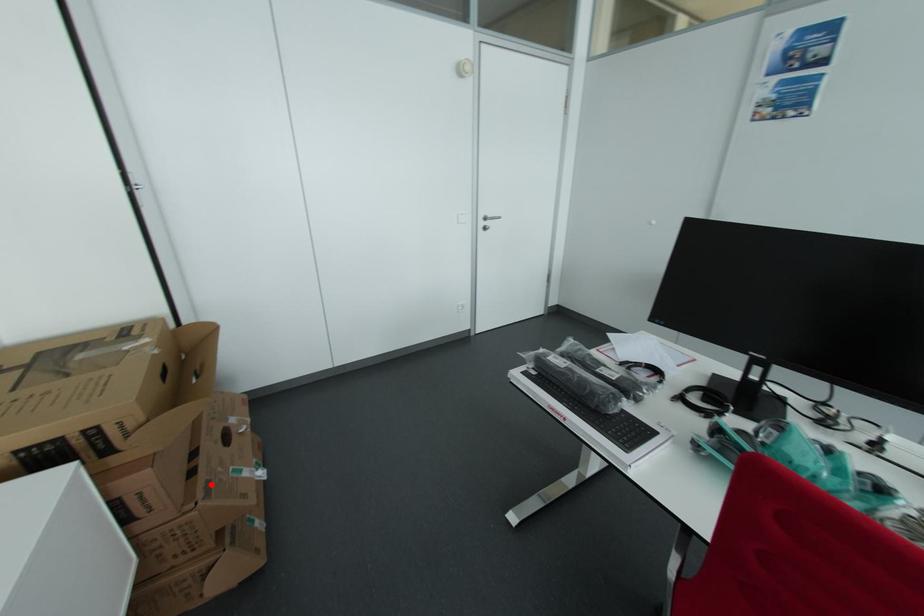
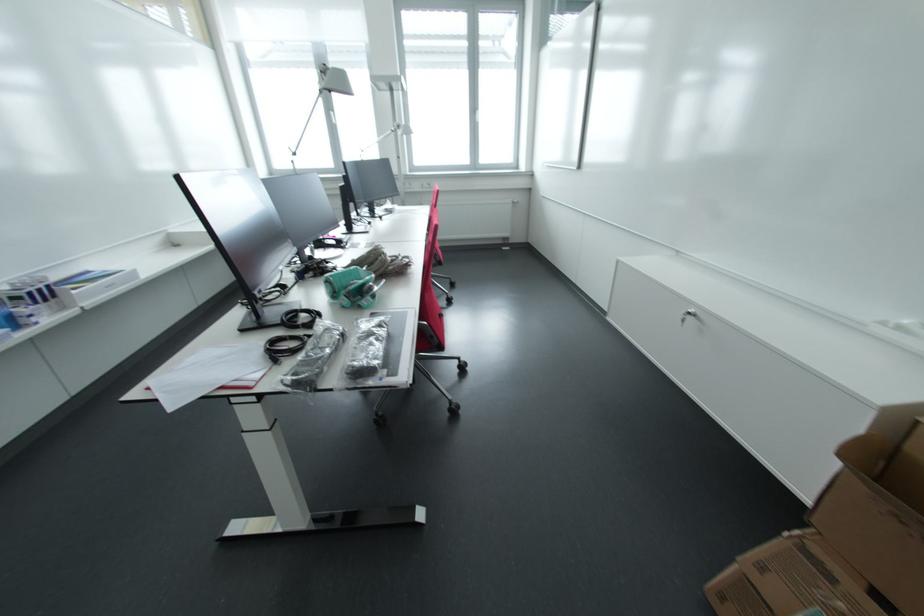
In the second image, find the point that corresponds to the highlighted location in the first image.

(833, 578)